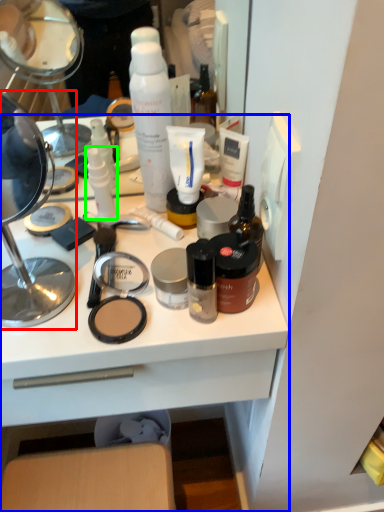
Question: Which object is positioned closest to magnifying glass (highlighted by a red box)? Select from desk (highlighted by a blue box) and toiletry (highlighted by a green box).

Choices:
 (A) desk
 (B) toiletry

Answer: (B)